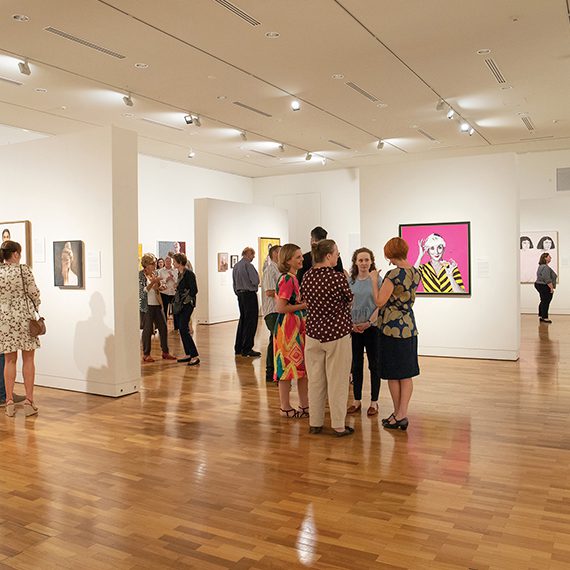
Where is `ceiling`? The height and width of the screenshot is (570, 570). ceiling is located at coordinates (434, 39).